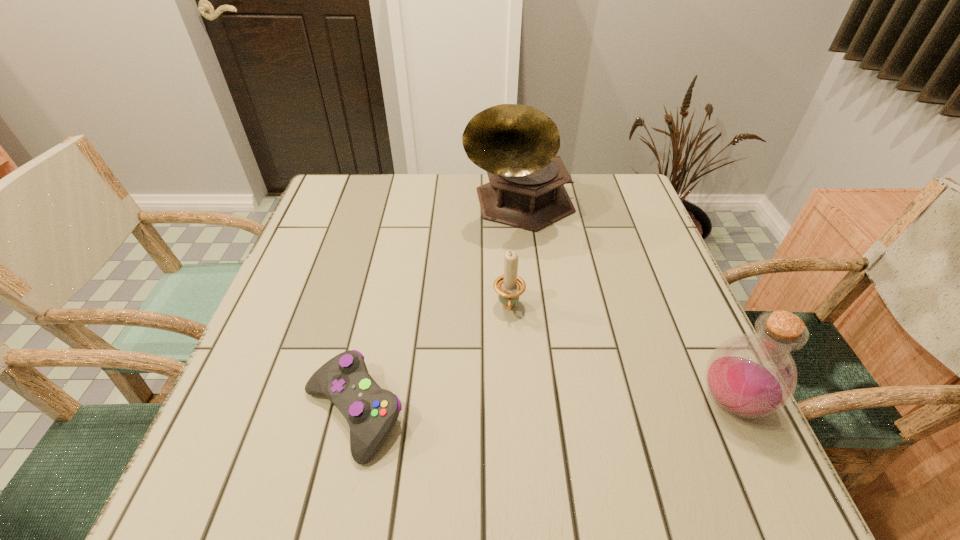
At what (x,y) coordinates should I click in order to perform the action: click on free region that satisfies the following two spatial constraints: 1. on the back side of the second farthest object; 2. on the left side of the farthest object. Please return your answer as a coordinate pair (x, y). This screenshot has width=960, height=540. Looking at the image, I should click on (502, 205).